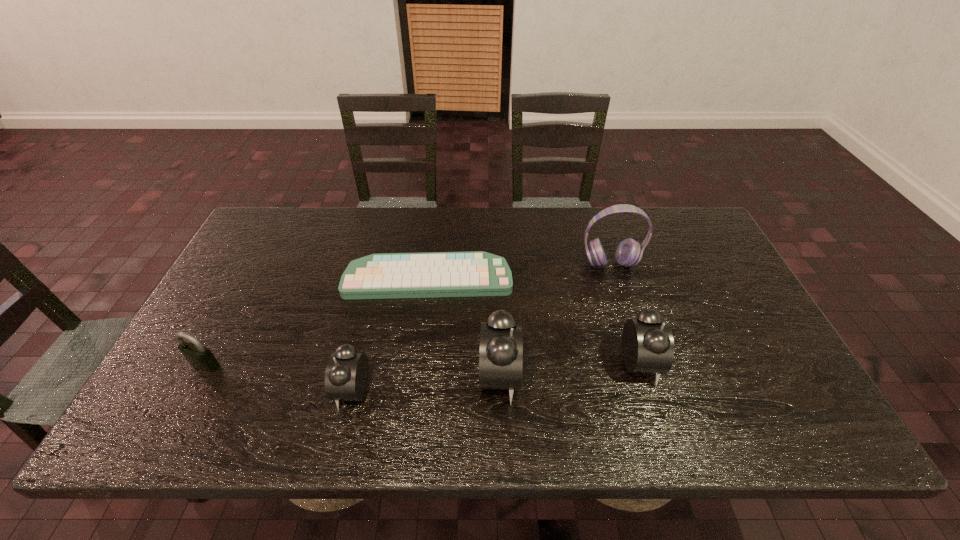
Where is `the leftmost alarm clock`? The image size is (960, 540). the leftmost alarm clock is located at coordinates (346, 376).

At what (x,y) coordinates should I click in order to perform the action: click on the second alarm clock from right to left. Please return your answer as a coordinate pair (x, y). Looking at the image, I should click on (501, 355).

Where is `the second tallest alarm clock`? the second tallest alarm clock is located at coordinates (647, 342).

Locate an element on the screen. the rightmost alarm clock is located at coordinates (647, 342).

Locate an element on the screen. This screenshot has height=540, width=960. headset is located at coordinates (629, 252).

The width and height of the screenshot is (960, 540). Find the location of `computer keyboard`. computer keyboard is located at coordinates (433, 274).

The height and width of the screenshot is (540, 960). Identify the location of padlock. (200, 357).

Where is `blank area located 0.160m on the front side of the shortest alarm clock`? This screenshot has width=960, height=540. blank area located 0.160m on the front side of the shortest alarm clock is located at coordinates (268, 389).

The height and width of the screenshot is (540, 960). Find the location of `vacant space located on the front side of the shortest alarm clock`. vacant space located on the front side of the shortest alarm clock is located at coordinates (251, 389).

Locate an element on the screen. Image resolution: width=960 pixels, height=540 pixels. free space located on the front side of the shortest alarm clock is located at coordinates (194, 389).